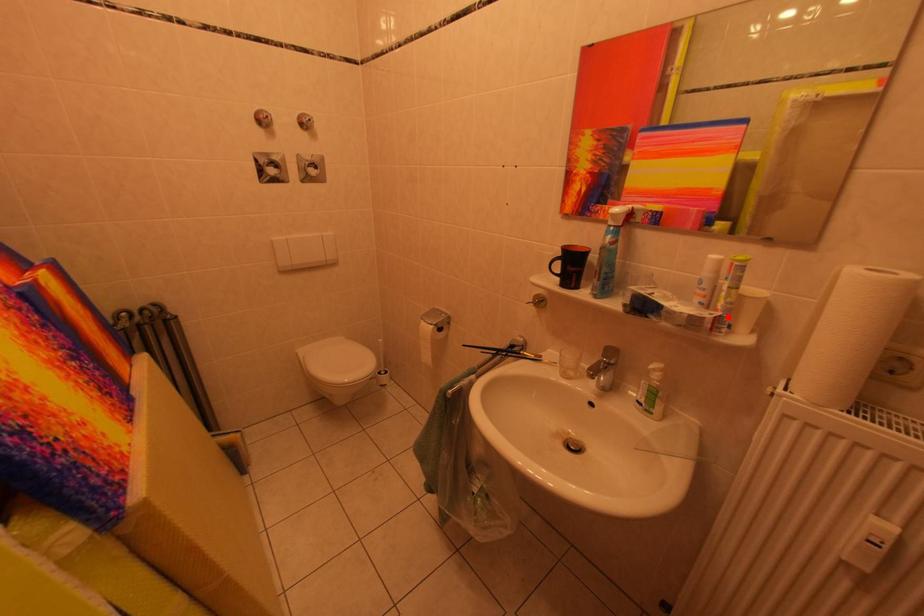
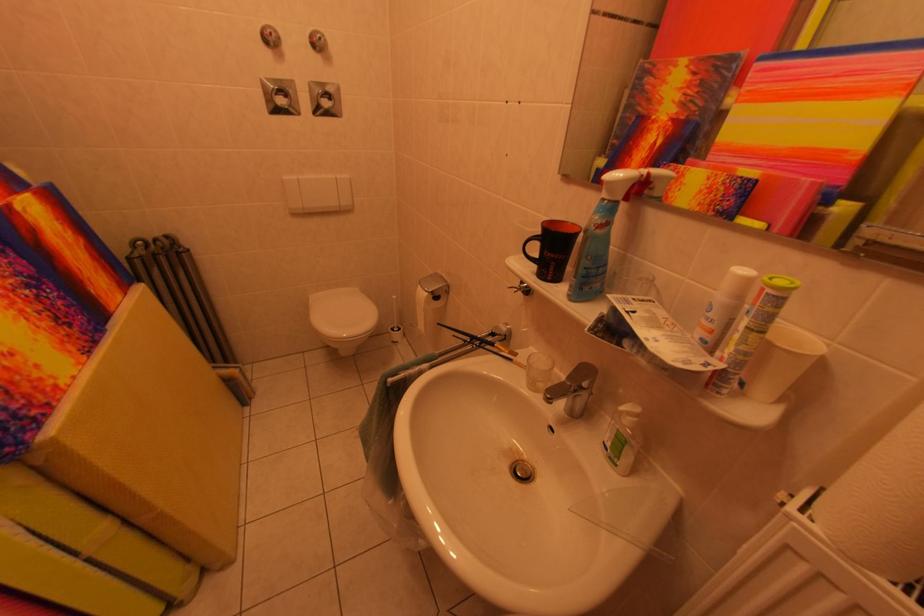
Locate, in the second image, the point that corresponds to the highlighted location in the first image.

(732, 370)